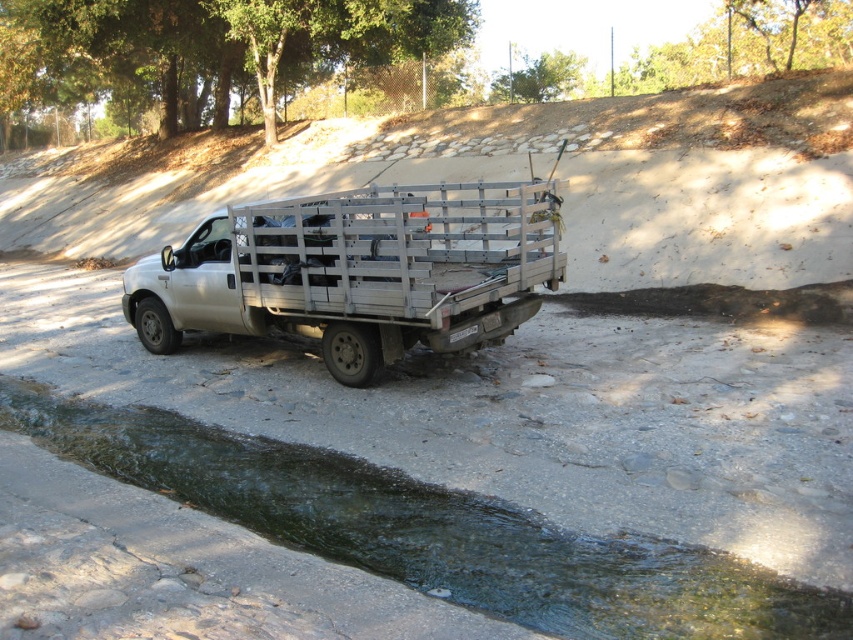
You are a delivery person who needs to cross the clear water at bottom left to reach the white metallic truck at center. The water is 1 meter deep. Your vehicle has a maximum fording depth of 1.2 meters. Can you safely cross the water to reach the truck?

The clear water at bottom left is 1 meter deep, which is within the vehicle maximum fording depth of 1.2 meters. Therefore, you can safely cross the water to reach the white metallic truck at center.

You are standing at the center of the image and want to walk to the clear water at bottom left. According to the coordinates provided, in which direction should you move?

The clear water at bottom left is located at point (430, 531). Since you are at the center, you should move towards the bottom left direction to reach it.